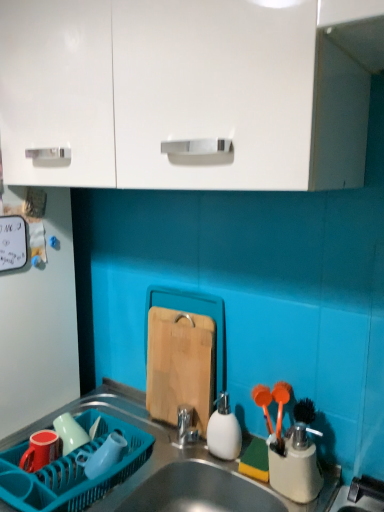
The width and height of the screenshot is (384, 512). Find the location of `free point to the right of matte ceramic mug at lower left, the 4th tableware positioned from the right`. free point to the right of matte ceramic mug at lower left, the 4th tableware positioned from the right is located at coordinates (92, 452).